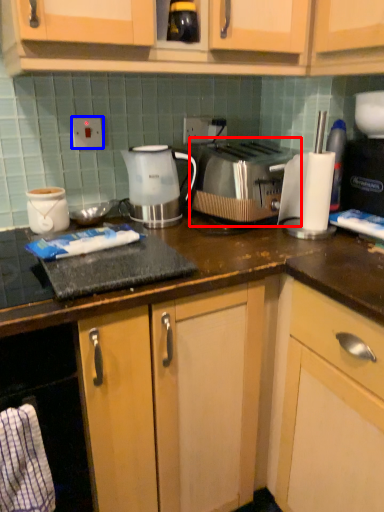
Question: Which point is further to the camera, toaster (highlighted by a red box) or electric outlet (highlighted by a blue box)?

Choices:
 (A) toaster
 (B) electric outlet

Answer: (B)